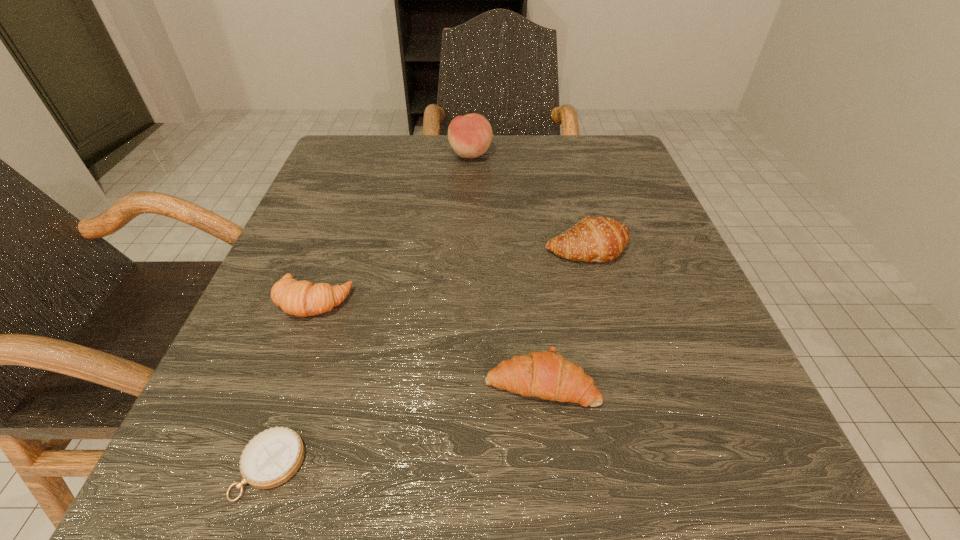
Identify the location of vacant space in between the second farthest crescent roll and the shortest object. This screenshot has width=960, height=540. (292, 383).

Find the location of a particular element. This screenshot has width=960, height=540. vacant space in between the third nearest object and the tallest object is located at coordinates (392, 228).

At what (x,y) coordinates should I click in order to perform the action: click on free space that is in between the second nearest crescent roll and the shortest object. Please return your answer as a coordinate pair (x, y). The image size is (960, 540). Looking at the image, I should click on (292, 383).

At what (x,y) coordinates should I click in order to perform the action: click on free space that is in between the nearest crescent roll and the third farthest object. Please return your answer as a coordinate pair (x, y). This screenshot has height=540, width=960. Looking at the image, I should click on (427, 342).

Where is `free spot between the compass and the peach`? free spot between the compass and the peach is located at coordinates (371, 310).

Locate an element on the screen. The width and height of the screenshot is (960, 540). free space between the compass and the fourth nearest object is located at coordinates click(429, 357).

You are a GUI agent. You are given a task and a screenshot of the screen. Output one action in this format:
    pyautogui.click(x=<x>, y=<y>)
    Task: Click on the object that is the second nearest to the tallest crescent roll
    Image resolution: width=960 pixels, height=540 pixels.
    Given the screenshot: What is the action you would take?
    pyautogui.click(x=470, y=136)

Select which object appears as the fourth closest to the farthest crescent roll. Please provide its 2D coordinates. Your answer should be formatted as a tuple, i.e. [(x, y)], where the tuple contains the x and y coordinates of a point satisfying the conditions above.

[(272, 457)]

Where is `crescent roll that can be found as the second closest to the second farthest crescent roll`? crescent roll that can be found as the second closest to the second farthest crescent roll is located at coordinates (600, 239).

Choose which crescent roll is the second nearest neighbor to the nearest object. Please provide its 2D coordinates. Your answer should be formatted as a tuple, i.e. [(x, y)], where the tuple contains the x and y coordinates of a point satisfying the conditions above.

[(544, 374)]